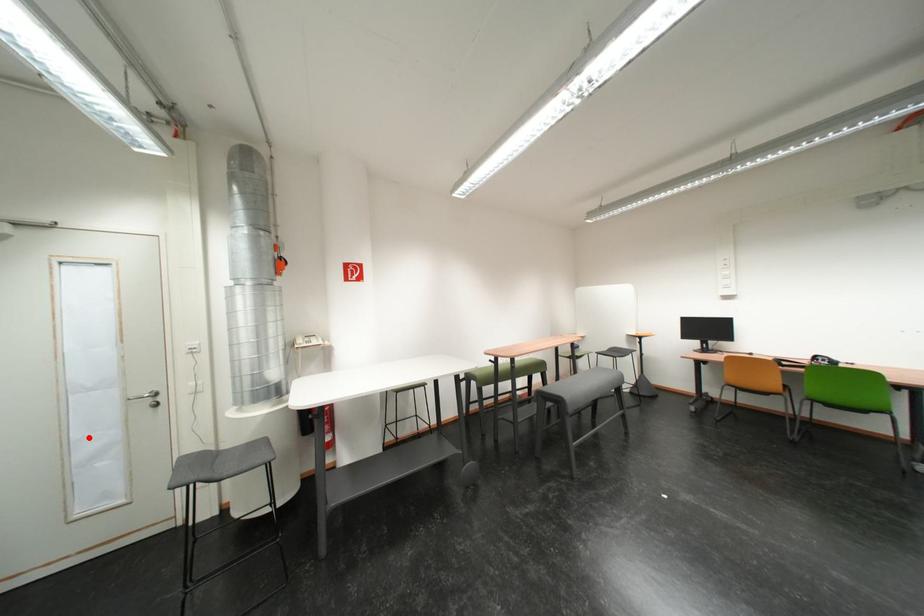
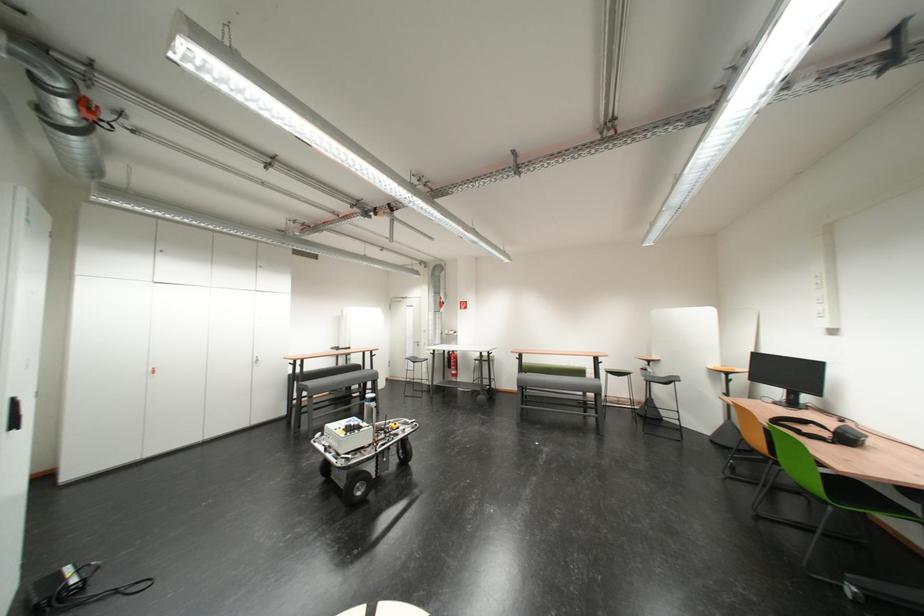
Find the pixel in the second image that matches the highlighted location in the first image.

(419, 351)